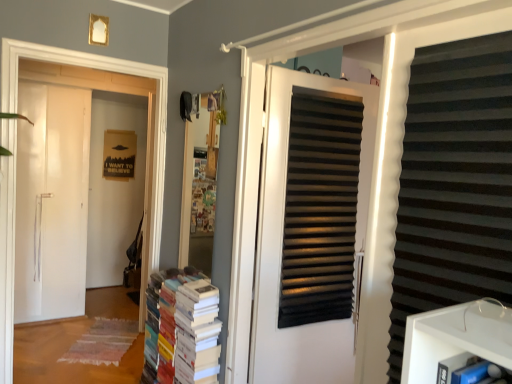
Find the location of a particular element. This screenshot has width=512, height=384. free space above black matte shutter at right (from a real-world perspective) is located at coordinates (448, 19).